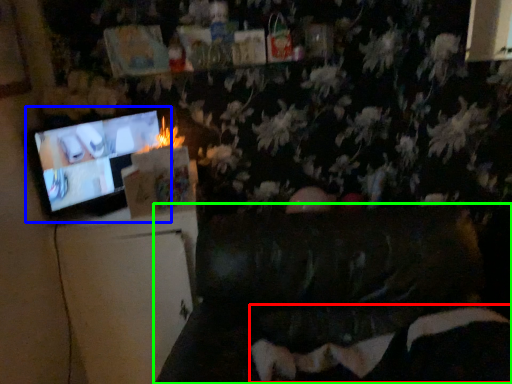
Question: Estimate the real-world distances between objects in this image. Which object is closer to bean bag chair (highlighted by a red box), television (highlighted by a blue box) or furniture (highlighted by a green box)?

Choices:
 (A) television
 (B) furniture

Answer: (B)